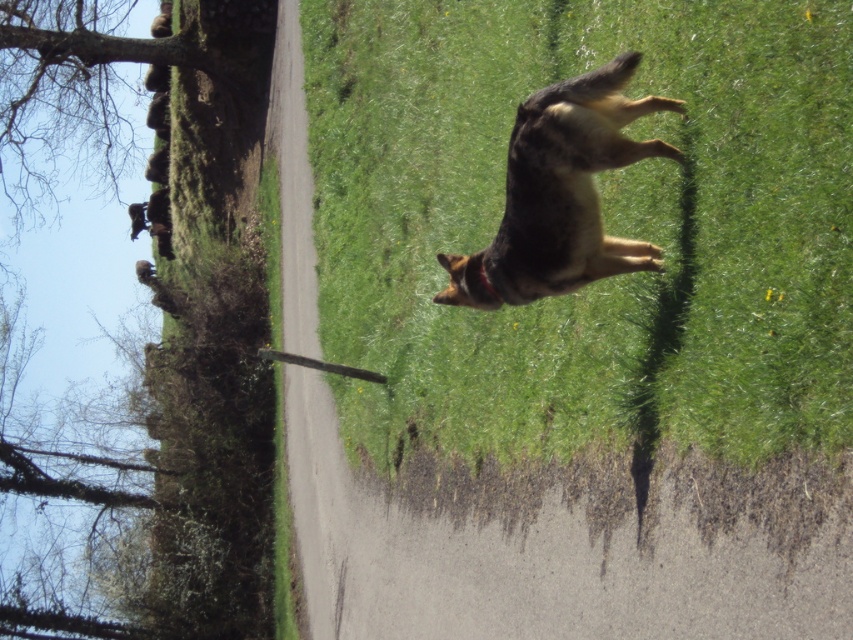
Question: Which point appears closest to the camera in this image?

Choices:
 (A) (822, 266)
 (B) (44, 19)

Answer: (A)

Question: Does dark brown fur dog at center appear on the right side of bare wood tree at upper left?

Choices:
 (A) yes
 (B) no

Answer: (A)

Question: In this image, where is dark brown fur dog at center located relative to bare wood tree at upper left?

Choices:
 (A) below
 (B) above

Answer: (A)

Question: Estimate the real-world distances between objects in this image. Which object is farther from the dark brown fur dog at center?

Choices:
 (A) green grass at upper right
 (B) bare wood tree at upper left

Answer: (B)

Question: Which object is positioned farthest from the bare wood tree at upper left?

Choices:
 (A) dark brown fur dog at center
 (B) green grass at upper right

Answer: (A)

Question: Is dark brown fur dog at center to the right of bare wood tree at upper left from the viewer's perspective?

Choices:
 (A) no
 (B) yes

Answer: (B)